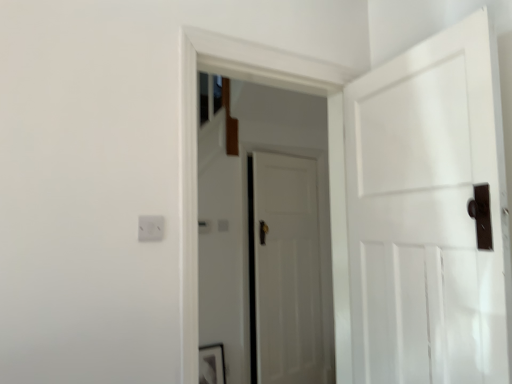
Question: In terms of size, does white matte door at center, positioned as the 2th door in front-to-back order, appear bigger or smaller than white matte door at center, marked as the 2th door in a back-to-front arrangement?

Choices:
 (A) small
 (B) big

Answer: (A)

Question: Is white matte door at center, positioned as the 2th door in front-to-back order, taller or shorter than white matte door at center, marked as the 2th door in a back-to-front arrangement?

Choices:
 (A) short
 (B) tall

Answer: (B)

Question: Which of these objects is positioned farthest from the matte black picture frame at lower center?

Choices:
 (A) white matte door at center, the 1th door from the front
 (B) white matte door at center, which is the first door from back to front

Answer: (A)

Question: Which is nearer to the matte black picture frame at lower center?

Choices:
 (A) white matte door at center, positioned as the 2th door in front-to-back order
 (B) white matte door at center, marked as the 2th door in a back-to-front arrangement

Answer: (A)